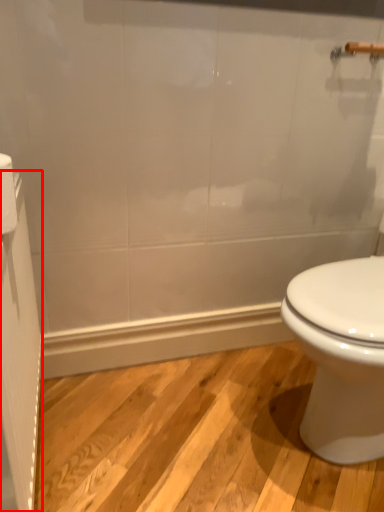
Question: From the image, what is the correct spatial relationship of screen door (annotated by the red box) in relation to toilet paper?

Choices:
 (A) right
 (B) left

Answer: (B)